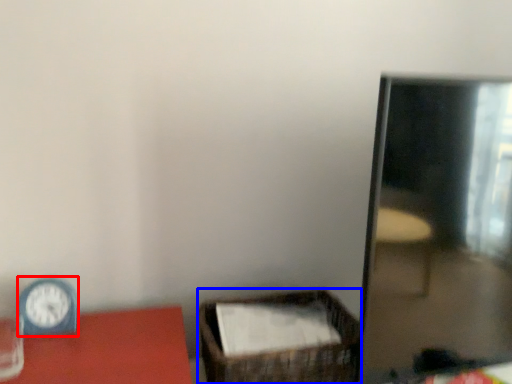
Question: Which of the following is the closest to the observer, clock (highlighted by a red box) or basket (highlighted by a blue box)?

Choices:
 (A) clock
 (B) basket

Answer: (A)